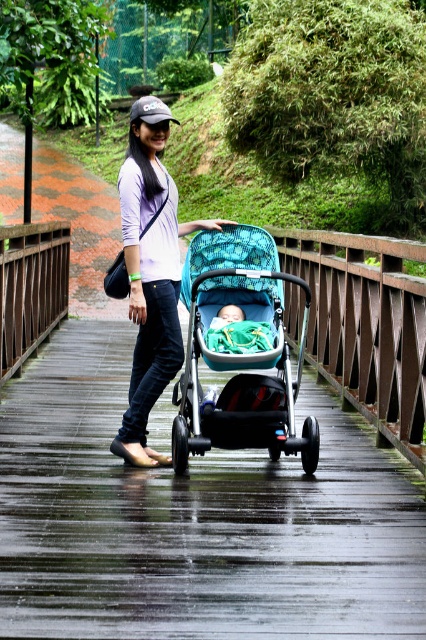
Consider the image. You are standing on the wooden bridge and see two points marked on the bridge surface. The first point is at coordinates point [238,461] and the second point is at point [215,442]. Which point is closer to the direction you are facing?

Point [215,442] is closer to the direction you are facing because it is in front of point [238,461].

You are a photographer standing on the wooden bridge and want to take a photo of the matte white shirt at center and the soft green fabric baby at center. Which object should you focus on first to ensure both are in sharp focus?

You should focus on the matte white shirt at center first because it is closer to the viewer than the soft green fabric baby at center, ensuring both will be in focus when using a shallow depth of field.

You are standing on the wooden bridge and want to locate the matte white shirt at center. Based on the coordinates provided, where should you look relative to the bridge?

The matte white shirt at center is located at coordinates point (150, 273) on the bridge. Since the coordinates are given as a point, you should look towards the center area of the bridge where the shirt is positioned.